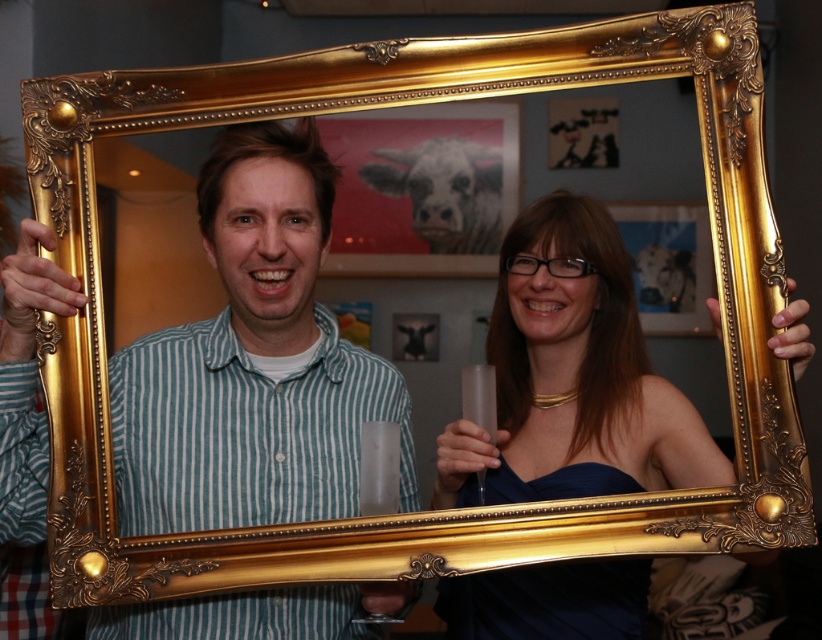
Can you confirm if matte gold frame at center is smaller than matte gold frame at right?

Yes, matte gold frame at center is smaller than matte gold frame at right.

Can you confirm if matte gold frame at center is positioned above matte gold frame at right?

Correct, matte gold frame at center is located above matte gold frame at right.

What do you see at coordinates (252, 362) in the screenshot? Image resolution: width=822 pixels, height=640 pixels. I see `matte gold frame at center` at bounding box center [252, 362].

Image resolution: width=822 pixels, height=640 pixels. I want to click on matte gold frame at center, so click(x=252, y=362).